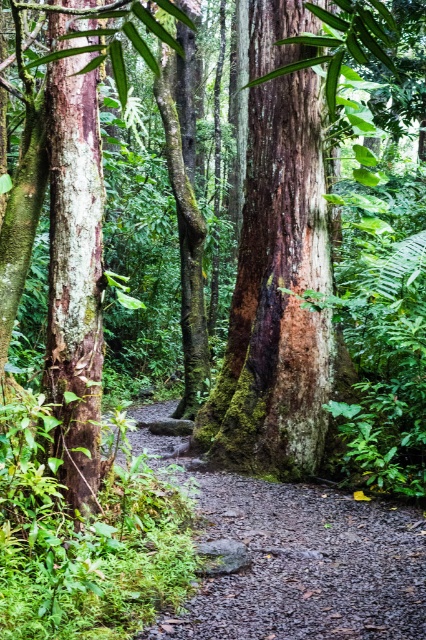
Question: Is damp gravel path at center thinner than smooth bark tree trunk at left?

Choices:
 (A) yes
 (B) no

Answer: (B)

Question: Which of the following is the closest to the observer?

Choices:
 (A) damp gravel path at center
 (B) smooth brown bark at center
 (C) smooth bark tree trunk at left

Answer: (A)

Question: Which object appears farthest from the camera in this image?

Choices:
 (A) smooth brown bark at center
 (B) smooth bark tree trunk at left
 (C) damp gravel path at center

Answer: (A)

Question: Which point is closer to the camera taking this photo?

Choices:
 (A) (411, 506)
 (B) (284, 202)

Answer: (A)

Question: Can you confirm if smooth brown bark at center is wider than smooth bark tree trunk at left?

Choices:
 (A) yes
 (B) no

Answer: (A)

Question: Is smooth brown bark at center above damp gravel path at center?

Choices:
 (A) no
 (B) yes

Answer: (B)